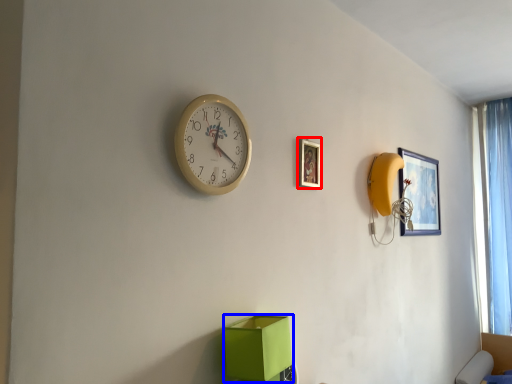
Question: Which object appears farthest to the camera in this image, picture frame (highlighted by a red box) or cardboard box (highlighted by a blue box)?

Choices:
 (A) picture frame
 (B) cardboard box

Answer: (A)